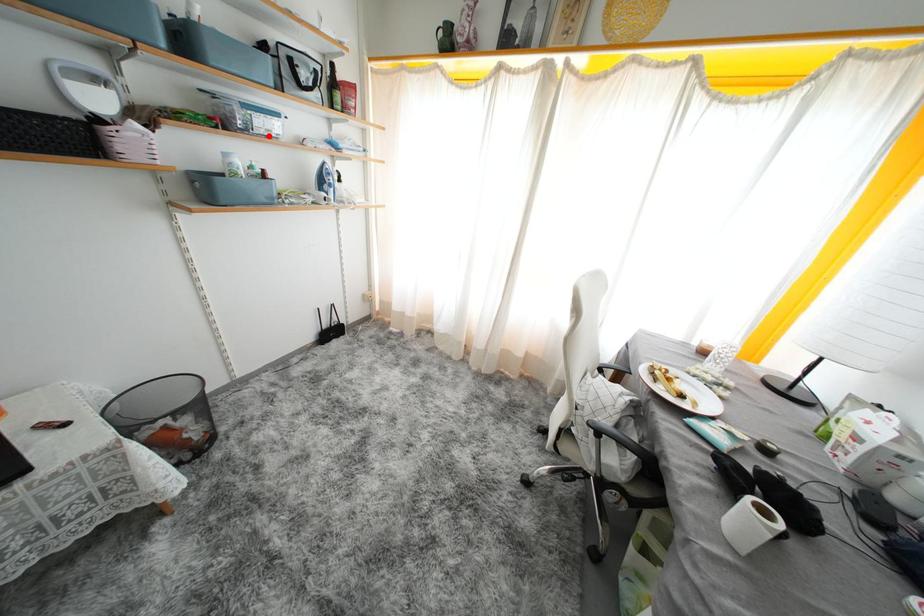
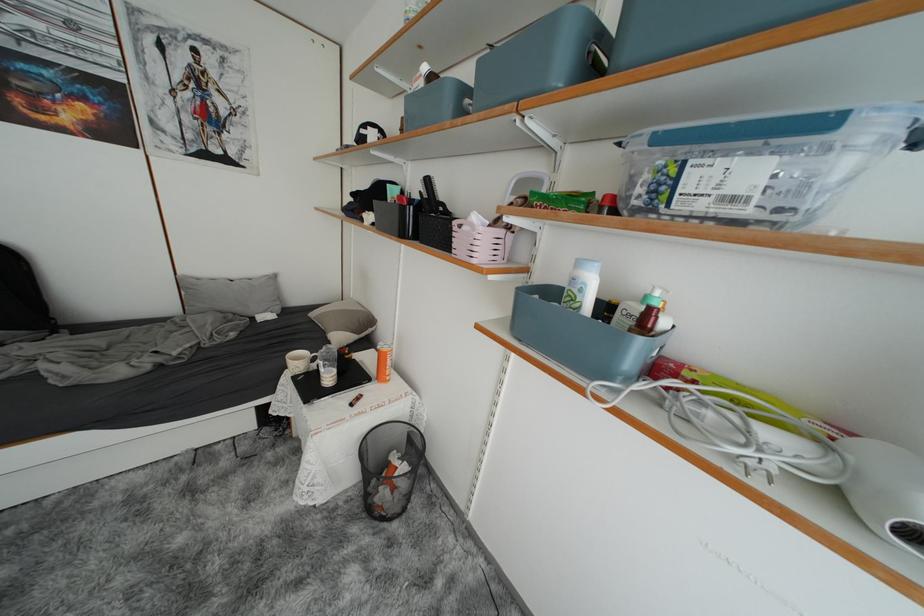
Locate, in the second image, the point that corresponds to the highlighted location in the first image.

(709, 209)